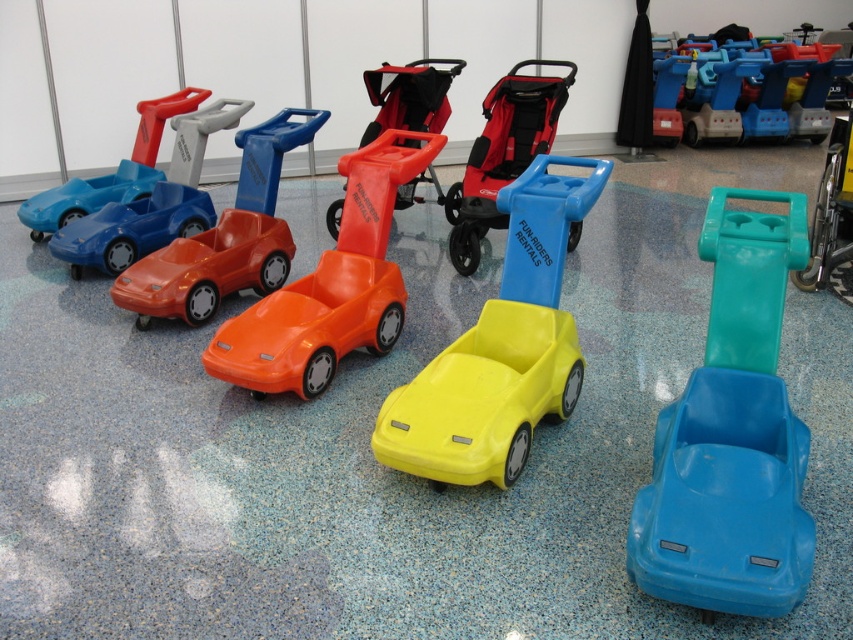
You are a child who wants to push the orange plastic car at center and the matte plastic stroller at center. If you stand in front of both, which one will your right hand reach first?

The orange plastic car at center is positioned on the left side of matte plastic stroller at center. Since you are standing in front of both, your right hand would naturally reach for the matte plastic stroller at center first because it is on the right side.